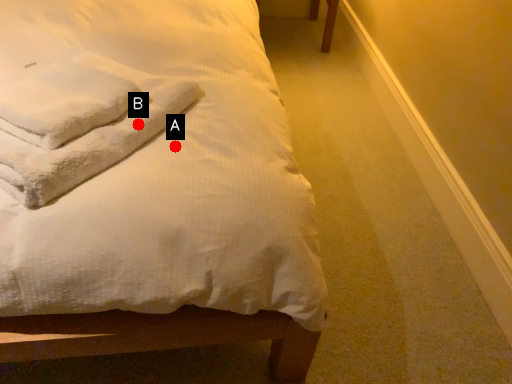
Question: Two points are circled on the image, labeled by A and B beside each circle. Which point is farther to the camera?

Choices:
 (A) A is further
 (B) B is further

Answer: (B)